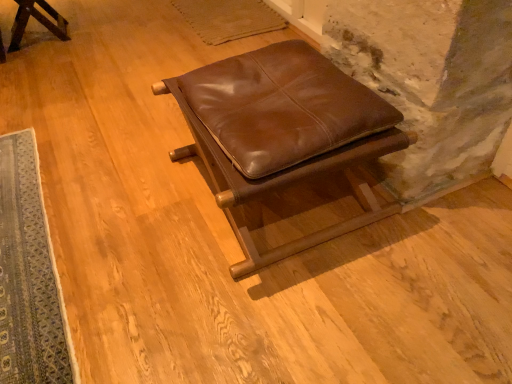
Locate an element on the screen. The width and height of the screenshot is (512, 384). free area in between brown leather ottoman at center, which is the first furniture in right-to-left order, and blue woven rug at lower left is located at coordinates (125, 209).